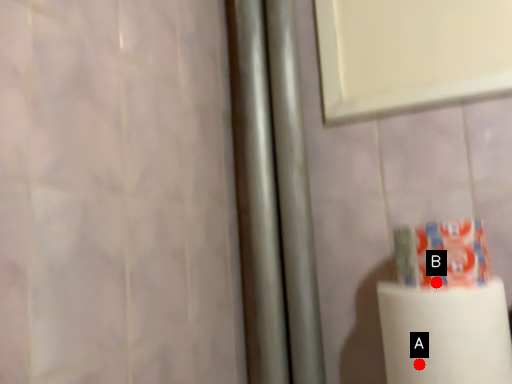
Question: Two points are circled on the image, labeled by A and B beside each circle. Which point appears closest to the camera in this image?

Choices:
 (A) A is closer
 (B) B is closer

Answer: (A)